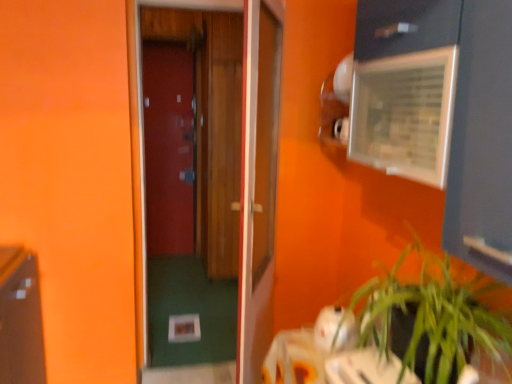
Question: Which direction should I rotate to look at wooden door at center, which is the 3th door in back-to-front order, — up or down?

Choices:
 (A) up
 (B) down

Answer: (B)

Question: Considering the relative sizes of wooden door at center, which is the second door in right-to-left order, and clear plastic medicine cabinet at upper right in the image provided, is wooden door at center, which is the second door in right-to-left order, shorter than clear plastic medicine cabinet at upper right?

Choices:
 (A) no
 (B) yes

Answer: (A)

Question: Are wooden door at center, positioned as the 2th door in front-to-back order, and clear plastic medicine cabinet at upper right making contact?

Choices:
 (A) yes
 (B) no

Answer: (B)

Question: Is wooden door at center, the second door viewed from the back, at the right side of clear plastic medicine cabinet at upper right?

Choices:
 (A) yes
 (B) no

Answer: (B)

Question: From the image's perspective, is wooden door at center, the second door viewed from the back, located beneath clear plastic medicine cabinet at upper right?

Choices:
 (A) yes
 (B) no

Answer: (A)

Question: Can clear plastic medicine cabinet at upper right be found inside wooden door at center, positioned as the 2th door in front-to-back order?

Choices:
 (A) no
 (B) yes

Answer: (A)

Question: Is wooden door at center, which is the second door in right-to-left order, closer to camera compared to clear plastic medicine cabinet at upper right?

Choices:
 (A) yes
 (B) no

Answer: (B)

Question: Is clear plastic medicine cabinet at upper right further to the viewer compared to wooden door at center, which appears as the third door when viewed from the left?

Choices:
 (A) yes
 (B) no

Answer: (B)

Question: From a real-world perspective, is clear plastic medicine cabinet at upper right positioned under wooden door at center, which is the 3th door in back-to-front order, based on gravity?

Choices:
 (A) no
 (B) yes

Answer: (A)

Question: Can you confirm if clear plastic medicine cabinet at upper right is smaller than wooden door at center, which is counted as the 1th door, starting from the right?

Choices:
 (A) yes
 (B) no

Answer: (A)

Question: Does clear plastic medicine cabinet at upper right have a lesser height compared to wooden door at center, which is counted as the 1th door, starting from the right?

Choices:
 (A) yes
 (B) no

Answer: (A)

Question: Does clear plastic medicine cabinet at upper right have a greater height compared to wooden door at center, which is counted as the 1th door, starting from the right?

Choices:
 (A) no
 (B) yes

Answer: (A)

Question: Is clear plastic medicine cabinet at upper right far from wooden door at center, which is counted as the 1th door, starting from the right?

Choices:
 (A) no
 (B) yes

Answer: (A)

Question: Considering the relative sizes of clear plastic medicine cabinet at upper right and green leafy plant at lower right in the image provided, is clear plastic medicine cabinet at upper right shorter than green leafy plant at lower right?

Choices:
 (A) yes
 (B) no

Answer: (A)